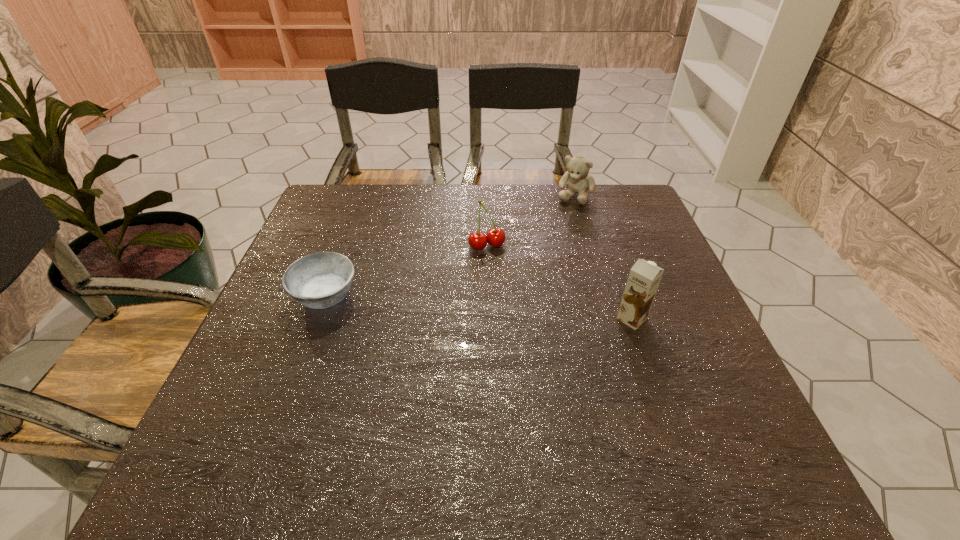
Locate an element on the screen. This screenshot has height=540, width=960. vacant position located with the stems of the cherry pointing upwards is located at coordinates (500, 268).

The image size is (960, 540). I want to click on vacant space positioned on the face of the farthest object, so click(545, 255).

Image resolution: width=960 pixels, height=540 pixels. Find the location of `vacant point located on the face of the farthest object`. vacant point located on the face of the farthest object is located at coordinates (538, 272).

What are the coordinates of `vacant space located 0.190m on the face of the farthest object` in the screenshot? It's located at (552, 242).

This screenshot has width=960, height=540. What are the coordinates of `object at the far edge` in the screenshot? It's located at (578, 181).

The height and width of the screenshot is (540, 960). In order to click on object that is positioned at the left edge in this screenshot , I will do `click(320, 280)`.

The height and width of the screenshot is (540, 960). In order to click on chocolate milk situated at the right edge in this screenshot , I will do `click(644, 277)`.

Find the location of a particular element. The width and height of the screenshot is (960, 540). teddy bear that is at the right edge is located at coordinates (578, 181).

The image size is (960, 540). I want to click on object located at the far right corner, so click(x=578, y=181).

The width and height of the screenshot is (960, 540). Find the location of `vacant area at the far edge of the desktop`. vacant area at the far edge of the desktop is located at coordinates (521, 226).